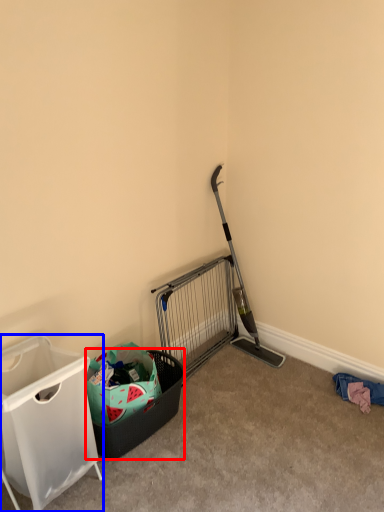
Question: Which object appears closest to the camera in this image, shopping basket (highlighted by a red box) or waste container (highlighted by a blue box)?

Choices:
 (A) shopping basket
 (B) waste container

Answer: (B)